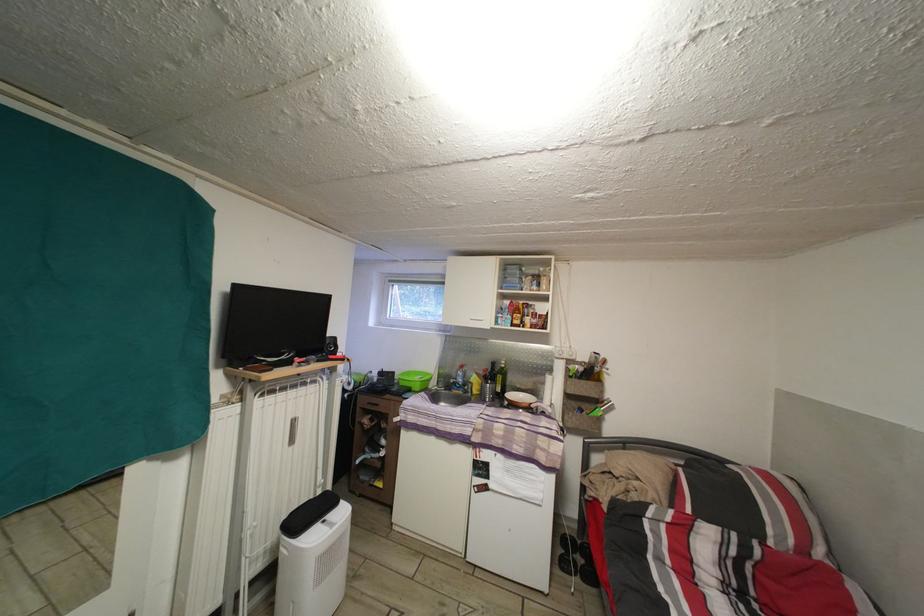
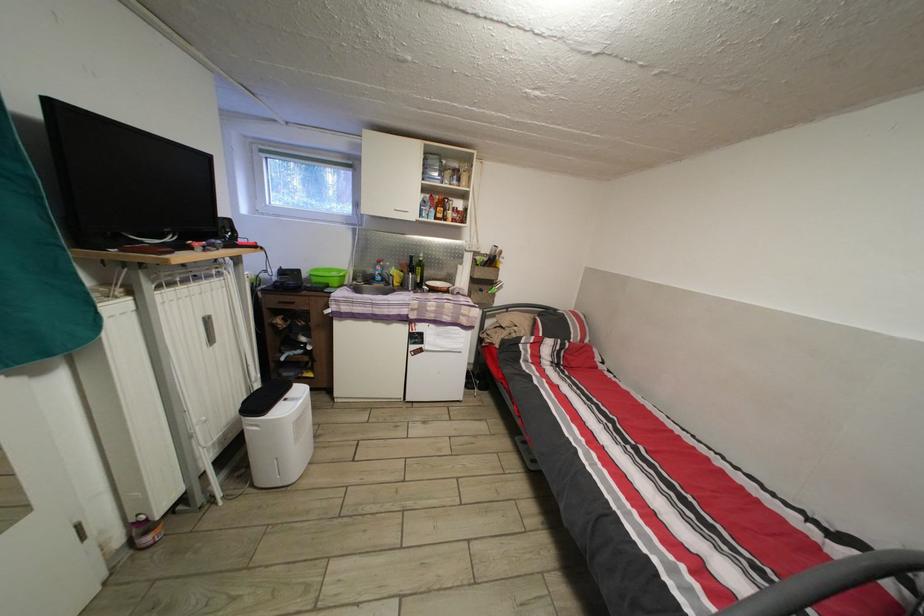
The point at [404,384] is marked in the first image. Where is the corresponding point in the second image?

(311, 282)